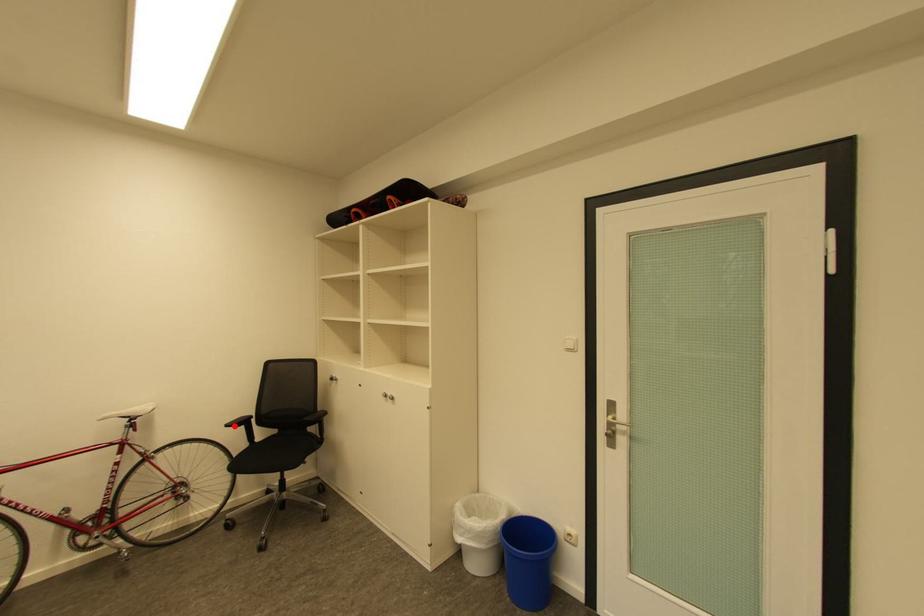
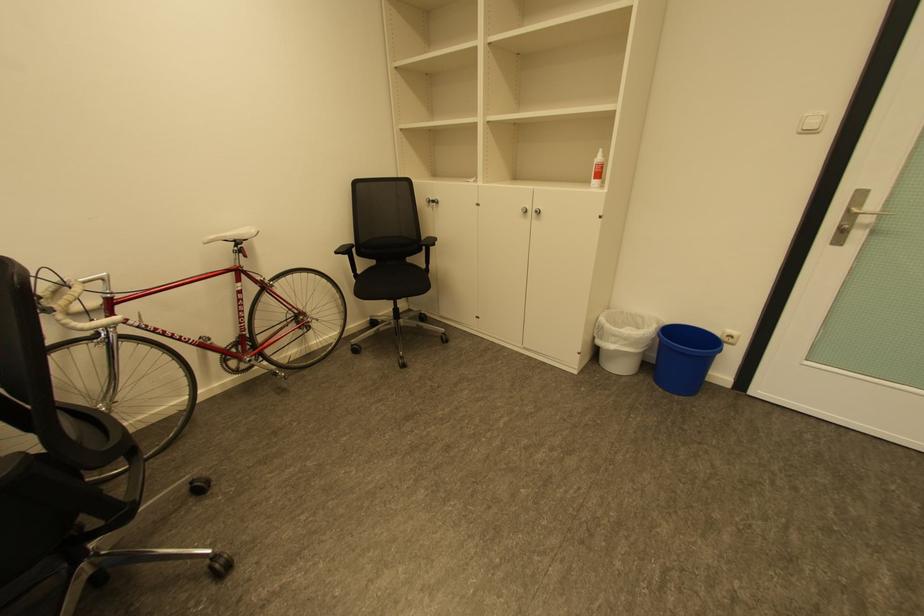
Question: I am providing you with two images of the same scene from different viewpoints. In image1, a red point is highlighted. Considering the same 3D point in image2, which of the following is correct?

Choices:
 (A) It is closer
 (B) It is farther

Answer: (A)